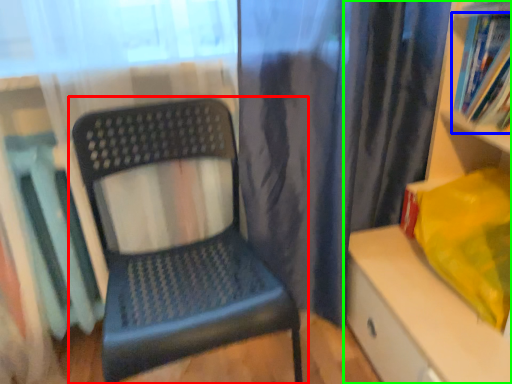
Question: Considering the real-world distances, which object is closest to chair (highlighted by a red box)? book (highlighted by a blue box) or shelf (highlighted by a green box).

Choices:
 (A) book
 (B) shelf

Answer: (B)